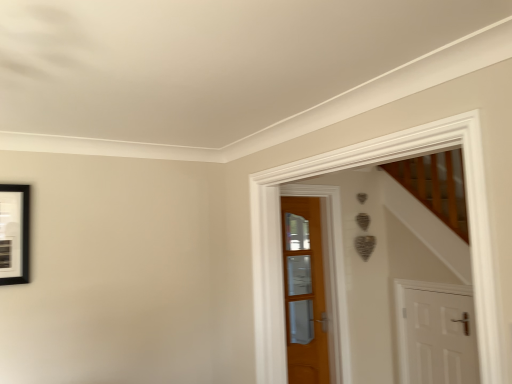
Describe the element at coordinates (440, 337) in the screenshot. This screenshot has height=384, width=512. I see `white matte door at lower right, positioned as the 1th door in right-to-left order` at that location.

Measure the distance between white matte door at lower right, acting as the second door starting from the left, and camera.

white matte door at lower right, acting as the second door starting from the left, and camera are 9.62 feet apart from each other.

Locate an element on the screen. The width and height of the screenshot is (512, 384). white matte door at lower right, acting as the second door starting from the left is located at coordinates click(440, 337).

How much space does white matte door at lower right, positioned as the 1th door in right-to-left order, occupy horizontally?

The width of white matte door at lower right, positioned as the 1th door in right-to-left order, is 2.29 inches.

Identify the location of wooden door at center, which ranks as the 2th door in right-to-left order. The width and height of the screenshot is (512, 384). (304, 291).

The image size is (512, 384). Describe the element at coordinates (304, 291) in the screenshot. I see `wooden door at center, which ranks as the 2th door in right-to-left order` at that location.

The width and height of the screenshot is (512, 384). I want to click on white matte door at lower right, acting as the second door starting from the left, so [440, 337].

Which is more to the left, white matte door at lower right, positioned as the 1th door in right-to-left order, or wooden door at center, arranged as the 1th door when viewed from the left?

From the viewer's perspective, wooden door at center, arranged as the 1th door when viewed from the left, appears more on the left side.

Looking at this image, relative to wooden door at center, which ranks as the 2th door in right-to-left order, is white matte door at lower right, acting as the second door starting from the left, in front or behind?

white matte door at lower right, acting as the second door starting from the left, is in front of wooden door at center, which ranks as the 2th door in right-to-left order.

Does point (453, 343) come closer to viewer compared to point (323, 312)?

Yes, point (453, 343) is closer to viewer.

From the image's perspective, which one is positioned higher, white matte door at lower right, positioned as the 1th door in right-to-left order, or wooden door at center, arranged as the 1th door when viewed from the left?

wooden door at center, arranged as the 1th door when viewed from the left, from the image's perspective.

From a real-world perspective, is white matte door at lower right, acting as the second door starting from the left, over wooden door at center, arranged as the 1th door when viewed from the left?

No, from a real-world perspective, white matte door at lower right, acting as the second door starting from the left, is not on top of wooden door at center, arranged as the 1th door when viewed from the left.

Is white matte door at lower right, acting as the second door starting from the left, thinner than wooden door at center, arranged as the 1th door when viewed from the left?

In fact, white matte door at lower right, acting as the second door starting from the left, might be wider than wooden door at center, arranged as the 1th door when viewed from the left.

Between white matte door at lower right, positioned as the 1th door in right-to-left order, and wooden door at center, which ranks as the 2th door in right-to-left order, which one has less height?

white matte door at lower right, positioned as the 1th door in right-to-left order, is shorter.

Which of these two, white matte door at lower right, acting as the second door starting from the left, or wooden door at center, which ranks as the 2th door in right-to-left order, is bigger?

With larger size is white matte door at lower right, acting as the second door starting from the left.

Would you say white matte door at lower right, positioned as the 1th door in right-to-left order, is inside or outside wooden door at center, which ranks as the 2th door in right-to-left order?

white matte door at lower right, positioned as the 1th door in right-to-left order, is located beyond the bounds of wooden door at center, which ranks as the 2th door in right-to-left order.

Is white matte door at lower right, positioned as the 1th door in right-to-left order, far from wooden door at center, which ranks as the 2th door in right-to-left order?

white matte door at lower right, positioned as the 1th door in right-to-left order, is near wooden door at center, which ranks as the 2th door in right-to-left order, not far away.

Is white matte door at lower right, positioned as the 1th door in right-to-left order, looking in the opposite direction of wooden door at center, which ranks as the 2th door in right-to-left order?

No, white matte door at lower right, positioned as the 1th door in right-to-left order, is not facing away from wooden door at center, which ranks as the 2th door in right-to-left order.

Can you tell me how much white matte door at lower right, acting as the second door starting from the left, and wooden door at center, which ranks as the 2th door in right-to-left order, differ in facing direction?

The angular difference between white matte door at lower right, acting as the second door starting from the left, and wooden door at center, which ranks as the 2th door in right-to-left order, is 88.2 degrees.

Measure the distance between white matte door at lower right, positioned as the 1th door in right-to-left order, and wooden door at center, arranged as the 1th door when viewed from the left.

white matte door at lower right, positioned as the 1th door in right-to-left order, is 85.32 centimeters away from wooden door at center, arranged as the 1th door when viewed from the left.

Identify the location of door in front of the wooden door at center, arranged as the 1th door when viewed from the left. click(x=440, y=337).

Visually, is wooden door at center, arranged as the 1th door when viewed from the left, positioned to the left or to the right of white matte door at lower right, acting as the second door starting from the left?

From the image, it's evident that wooden door at center, arranged as the 1th door when viewed from the left, is to the left of white matte door at lower right, acting as the second door starting from the left.

Considering the positions of objects wooden door at center, which ranks as the 2th door in right-to-left order, and white matte door at lower right, acting as the second door starting from the left, in the image provided, who is in front, wooden door at center, which ranks as the 2th door in right-to-left order, or white matte door at lower right, acting as the second door starting from the left,?

white matte door at lower right, acting as the second door starting from the left, is more forward.

Which point is more distant from viewer, (287,277) or (431,353)?

The point (287,277) is behind.

From the image's perspective, would you say wooden door at center, arranged as the 1th door when viewed from the left, is shown under white matte door at lower right, acting as the second door starting from the left?

No, from the image's perspective, wooden door at center, arranged as the 1th door when viewed from the left, is not below white matte door at lower right, acting as the second door starting from the left.

From a real-world perspective, between wooden door at center, which ranks as the 2th door in right-to-left order, and white matte door at lower right, positioned as the 1th door in right-to-left order, who is vertically higher?

From a 3D spatial view, wooden door at center, which ranks as the 2th door in right-to-left order, is above.

Does wooden door at center, arranged as the 1th door when viewed from the left, have a lesser width compared to white matte door at lower right, positioned as the 1th door in right-to-left order?

Indeed, wooden door at center, arranged as the 1th door when viewed from the left, has a lesser width compared to white matte door at lower right, positioned as the 1th door in right-to-left order.

Is wooden door at center, arranged as the 1th door when viewed from the left, taller than white matte door at lower right, positioned as the 1th door in right-to-left order?

Yes, wooden door at center, arranged as the 1th door when viewed from the left, is taller than white matte door at lower right, positioned as the 1th door in right-to-left order.

In the scene shown: Which of these two, wooden door at center, which ranks as the 2th door in right-to-left order, or white matte door at lower right, acting as the second door starting from the left, is smaller?

Smaller between the two is wooden door at center, which ranks as the 2th door in right-to-left order.

Is wooden door at center, arranged as the 1th door when viewed from the left, not within white matte door at lower right, positioned as the 1th door in right-to-left order?

Absolutely, wooden door at center, arranged as the 1th door when viewed from the left, is external to white matte door at lower right, positioned as the 1th door in right-to-left order.

Is wooden door at center, arranged as the 1th door when viewed from the left, next to white matte door at lower right, positioned as the 1th door in right-to-left order, and touching it?

No, wooden door at center, arranged as the 1th door when viewed from the left, is not touching white matte door at lower right, positioned as the 1th door in right-to-left order.

Is wooden door at center, which ranks as the 2th door in right-to-left order, turned away from white matte door at lower right, acting as the second door starting from the left?

No, wooden door at center, which ranks as the 2th door in right-to-left order,'s orientation is not away from white matte door at lower right, acting as the second door starting from the left.

How different are the orientations of wooden door at center, arranged as the 1th door when viewed from the left, and white matte door at lower right, acting as the second door starting from the left, in degrees?

The facing directions of wooden door at center, arranged as the 1th door when viewed from the left, and white matte door at lower right, acting as the second door starting from the left, are 88.2 degrees apart.

How much distance is there between wooden door at center, which ranks as the 2th door in right-to-left order, and white matte door at lower right, positioned as the 1th door in right-to-left order?

85.32 centimeters.

This screenshot has height=384, width=512. What are the coordinates of `door above the white matte door at lower right, acting as the second door starting from the left (from the image's perspective)` in the screenshot? It's located at (304, 291).

At what (x,y) coordinates should I click in order to perform the action: click on door above the white matte door at lower right, positioned as the 1th door in right-to-left order (from a real-world perspective). Please return your answer as a coordinate pair (x, y). Looking at the image, I should click on (304, 291).

This screenshot has height=384, width=512. Find the location of `door that appears above the white matte door at lower right, acting as the second door starting from the left (from the image's perspective)`. door that appears above the white matte door at lower right, acting as the second door starting from the left (from the image's perspective) is located at coordinates (304, 291).